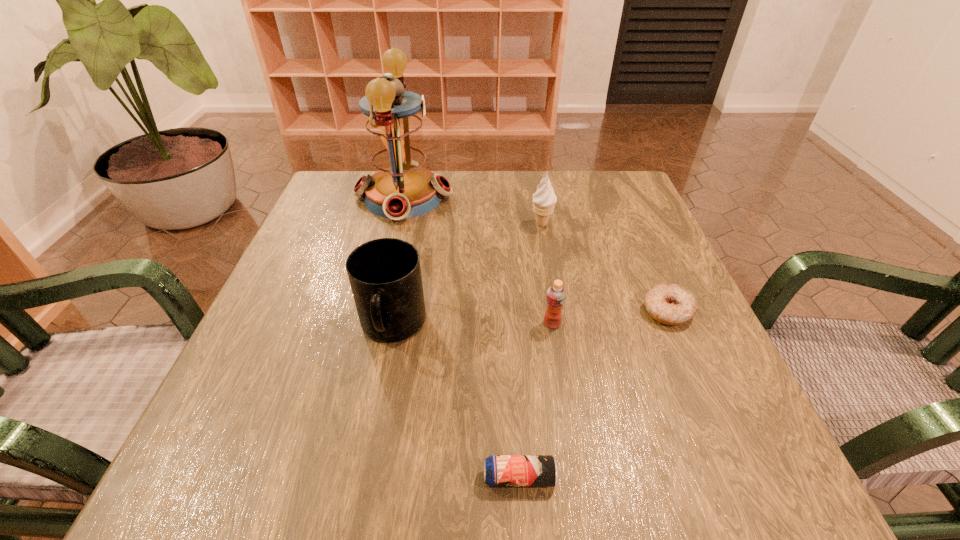
I want to click on vacant area situated 0.060m on the back of the fourth tallest object, so pyautogui.click(x=547, y=294).

Identify the location of vacant space located 0.160m on the left of the doughnut. This screenshot has width=960, height=540. (556, 311).

Find the location of `free space located on the left of the fourth object from right to left`. free space located on the left of the fourth object from right to left is located at coordinates (215, 477).

Locate an element on the screen. The image size is (960, 540). lantern located in the far edge section of the desktop is located at coordinates (401, 187).

Where is `icecream located in the far edge section of the desktop`? icecream located in the far edge section of the desktop is located at coordinates (544, 199).

Where is `object that is positioned at the near edge`? Image resolution: width=960 pixels, height=540 pixels. object that is positioned at the near edge is located at coordinates (499, 470).

This screenshot has height=540, width=960. In order to click on object positioned at the left edge in this screenshot , I will do `click(401, 187)`.

Find the location of a particular element. This screenshot has height=540, width=960. object that is at the right edge is located at coordinates (667, 303).

This screenshot has width=960, height=540. Identify the location of object at the far left corner. (401, 187).

Identify the location of vacant space at the far edge of the desktop. Image resolution: width=960 pixels, height=540 pixels. (468, 201).